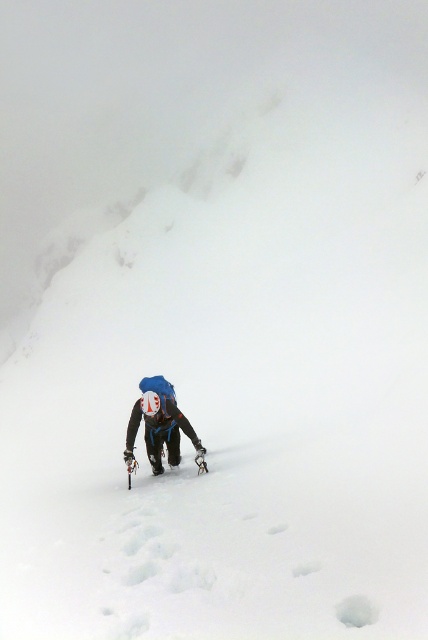
Does blue fabric backpack at center have a greater width compared to metallic silver ski at center?

Correct, the width of blue fabric backpack at center exceeds that of metallic silver ski at center.

Who is more forward, (201,445) or (196,461)?

Point (201,445) is more forward.

Between point (155, 461) and point (202, 451), which one is positioned in front?

Positioned in front is point (202, 451).

Where is `blue fabric backpack at center`? This screenshot has width=428, height=640. blue fabric backpack at center is located at coordinates (160, 424).